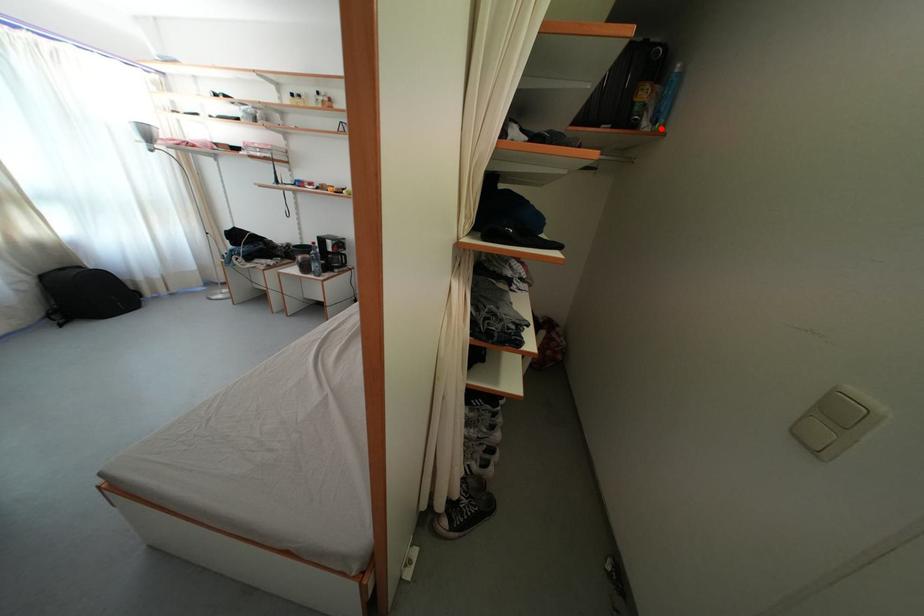
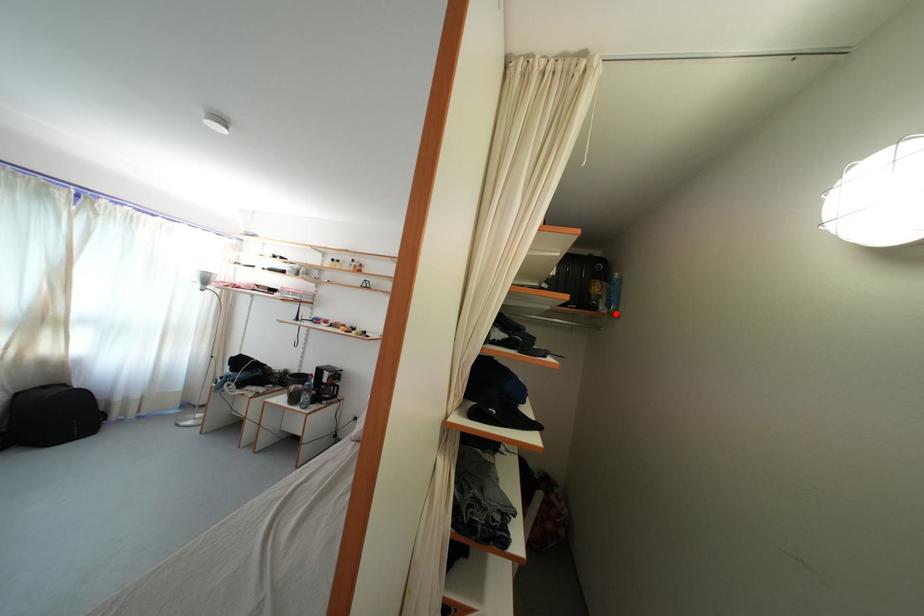
Consider the image. I am providing you with two images of the same scene from different viewpoints. A red point is marked on the first image and another point is marked on the second image. Are the points marked in image1 and image2 representing the same 3D position?

Yes